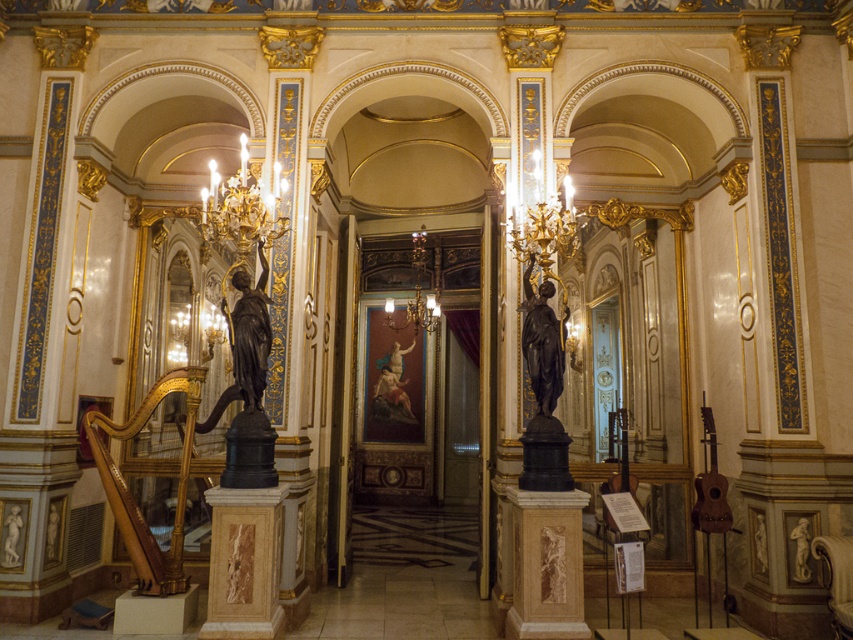
Question: Among these objects, which one is farthest from the camera?

Choices:
 (A) bronze statue at center
 (B) black polished statue at center

Answer: (B)

Question: Which point is closer to the camera?

Choices:
 (A) bronze statue at center
 (B) gold/gilded chandelier at upper center

Answer: (A)

Question: Which point is closer to the camera?

Choices:
 (A) black polished statue at center
 (B) bronze statue at center
 (C) gold/gilded chandelier at upper center

Answer: (B)

Question: Observing the image, what is the correct spatial positioning of bronze statue at center in reference to black polished statue at center?

Choices:
 (A) left
 (B) right

Answer: (A)

Question: Is gold/gilded chandelier at upper center closer to the viewer compared to bronze statue at center?

Choices:
 (A) no
 (B) yes

Answer: (A)

Question: Observing the image, what is the correct spatial positioning of gold/gilded chandelier at upper center in reference to black polished statue at center?

Choices:
 (A) below
 (B) above

Answer: (B)